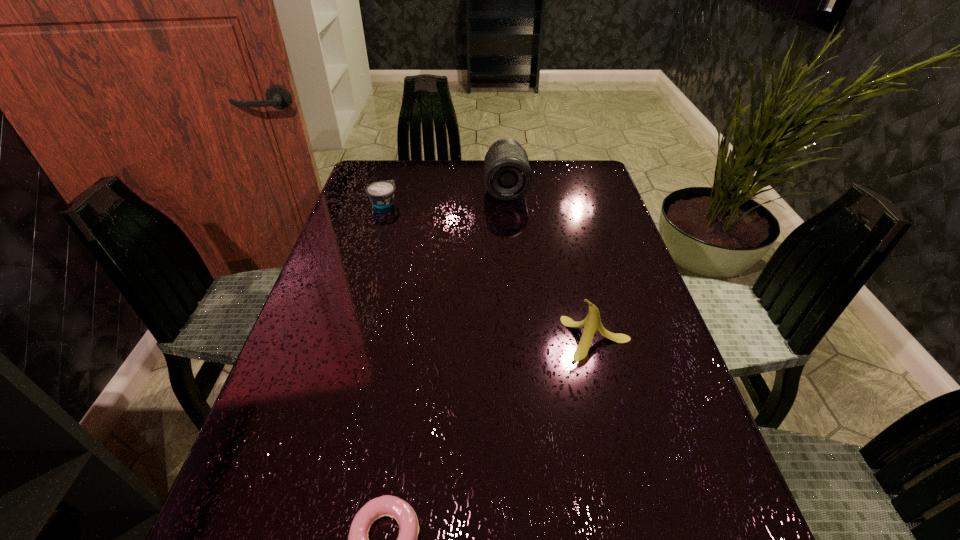
The image size is (960, 540). What are the coordinates of `free space between the second tallest object and the leftmost object` in the screenshot? It's located at (491, 271).

Select which object appears as the closest to the third object from left to right. Please provide its 2D coordinates. Your answer should be formatted as a tuple, i.e. [(x, y)], where the tuple contains the x and y coordinates of a point satisfying the conditions above.

[(381, 194)]

Where is `object identified as the third closest to the second nearest object`? Image resolution: width=960 pixels, height=540 pixels. object identified as the third closest to the second nearest object is located at coordinates [381, 194].

Identify the location of free space that satisfies the following two spatial constraints: 1. on the surface of the second nearest object; 2. on the left side of the second object from right to left. (518, 339).

Image resolution: width=960 pixels, height=540 pixels. What are the coordinates of `free location that satisfies the following two spatial constraints: 1. on the surface of the banana; 2. on the left side of the tallest object` in the screenshot? It's located at (518, 339).

Image resolution: width=960 pixels, height=540 pixels. I want to click on blank space that satisfies the following two spatial constraints: 1. on the surface of the second object from right to left; 2. on the right side of the banana, so click(x=518, y=339).